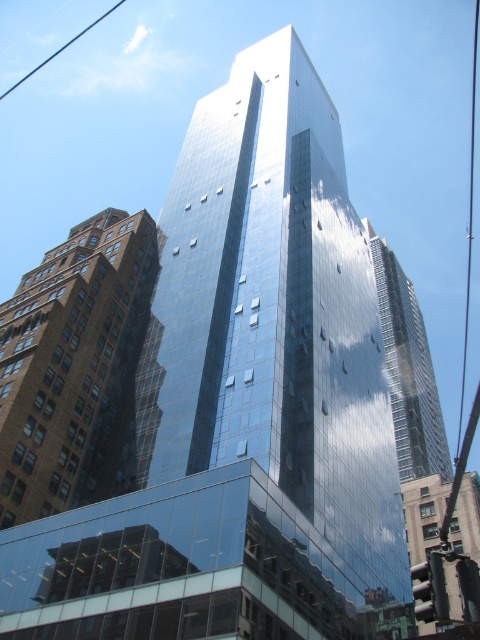
Does brown brick building at left come behind shiny glass skyscraper at center?

That is False.

Which is more to the right, brown brick building at left or shiny glass skyscraper at center?

From the viewer's perspective, shiny glass skyscraper at center appears more on the right side.

Image resolution: width=480 pixels, height=640 pixels. I want to click on brown brick building at left, so click(62, 356).